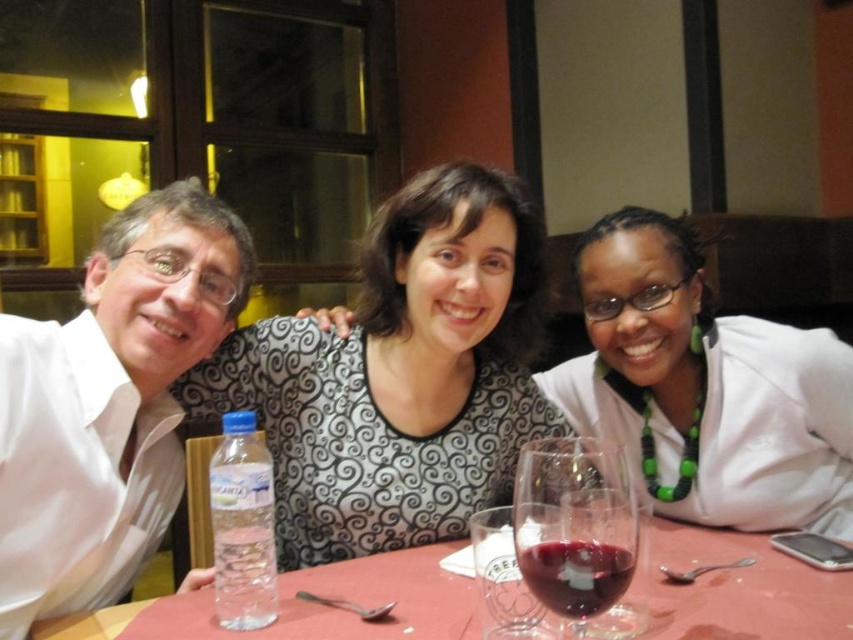
Does black matte shirt at center appear on the left side of white glossy shirt at left?

In fact, black matte shirt at center is to the right of white glossy shirt at left.

Consider the image. Does black matte shirt at center appear over white glossy shirt at left?

Actually, black matte shirt at center is below white glossy shirt at left.

Who is more forward, [306,390] or [161,320]?

Point [161,320] is more forward.

The width and height of the screenshot is (853, 640). I want to click on black matte shirt at center, so click(399, 376).

Which is above, transparent glass at table center or clear plastic bottle at lower left?

clear plastic bottle at lower left

This screenshot has height=640, width=853. What do you see at coordinates (575, 529) in the screenshot?
I see `transparent glass at table center` at bounding box center [575, 529].

The width and height of the screenshot is (853, 640). Identify the location of transparent glass at table center. (575, 529).

Locate an element on the screen. Image resolution: width=853 pixels, height=640 pixels. transparent glass at table center is located at coordinates (575, 529).

Who is positioned more to the right, smooth plastic water bottle at lower left or clear plastic bottle at lower left?

smooth plastic water bottle at lower left is more to the right.

Is smooth plastic water bottle at lower left below clear plastic bottle at lower left?

Yes, smooth plastic water bottle at lower left is below clear plastic bottle at lower left.

What do you see at coordinates (306, 605) in the screenshot? I see `smooth plastic water bottle at lower left` at bounding box center [306, 605].

Find the location of a particular element. smooth plastic water bottle at lower left is located at coordinates (306, 605).